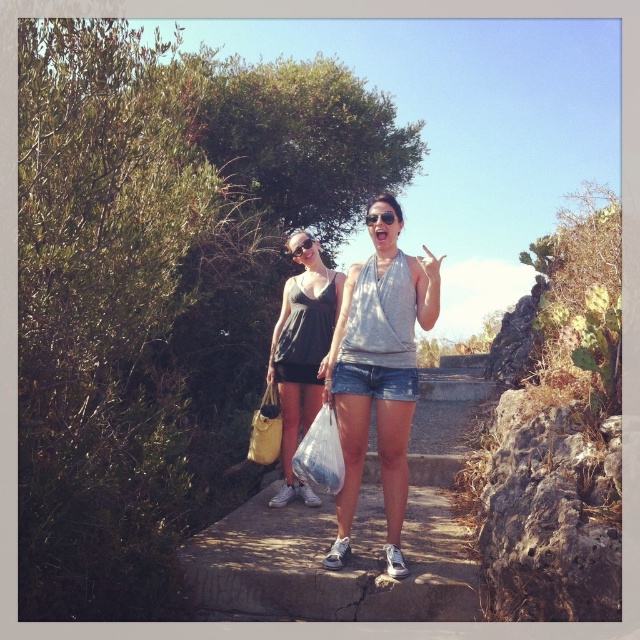
Question: Does concrete stairs at center have a lesser width compared to matte black dress at center?

Choices:
 (A) yes
 (B) no

Answer: (A)

Question: Which is farther from the matte yellow fabric bag at center?

Choices:
 (A) gray cotton tank top at center
 (B) concrete stairs at center

Answer: (B)

Question: Estimate the real-world distances between objects in this image. Which object is closer to the gray cotton tank top at center?

Choices:
 (A) concrete stairs at center
 (B) matte yellow fabric bag at center
 (C) denim shorts at center

Answer: (C)

Question: Does matte black dress at center appear under matte yellow fabric bag at center?

Choices:
 (A) no
 (B) yes

Answer: (A)

Question: In this image, where is matte black dress at center located relative to translucent plastic bag at center?

Choices:
 (A) right
 (B) left

Answer: (B)

Question: Estimate the real-world distances between objects in this image. Which object is farther from the transparent plastic goggles at center?

Choices:
 (A) matte black dress at center
 (B) matte yellow fabric bag at center
 (C) concrete stairs at center
 (D) denim shorts at center

Answer: (C)